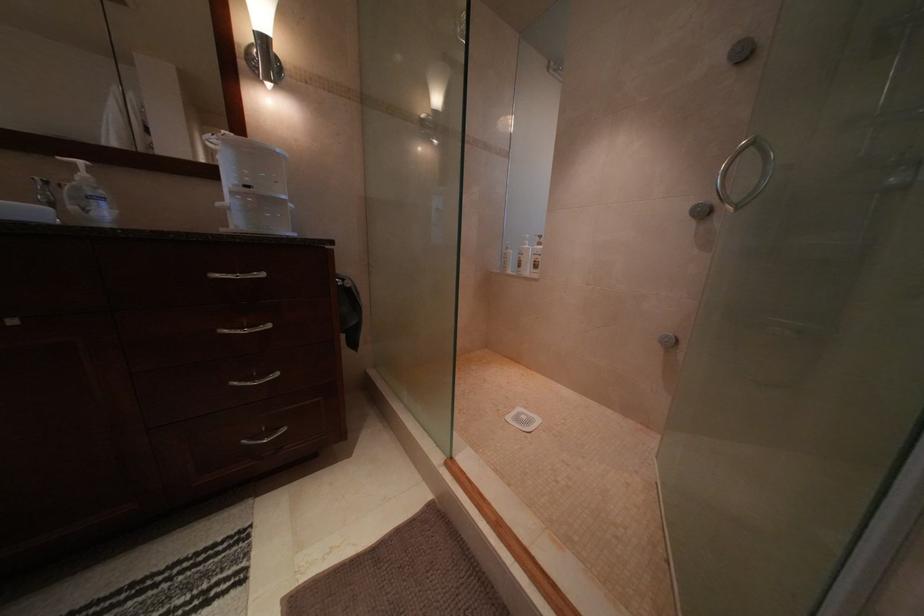
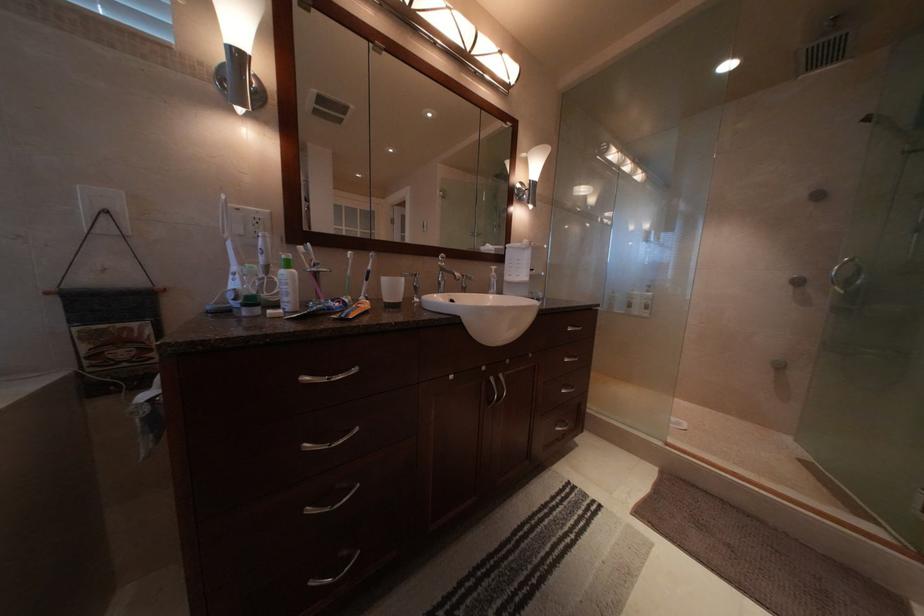
Which direction would the cameraman need to move to produce the second image?

The cameraman walked toward left, backward.